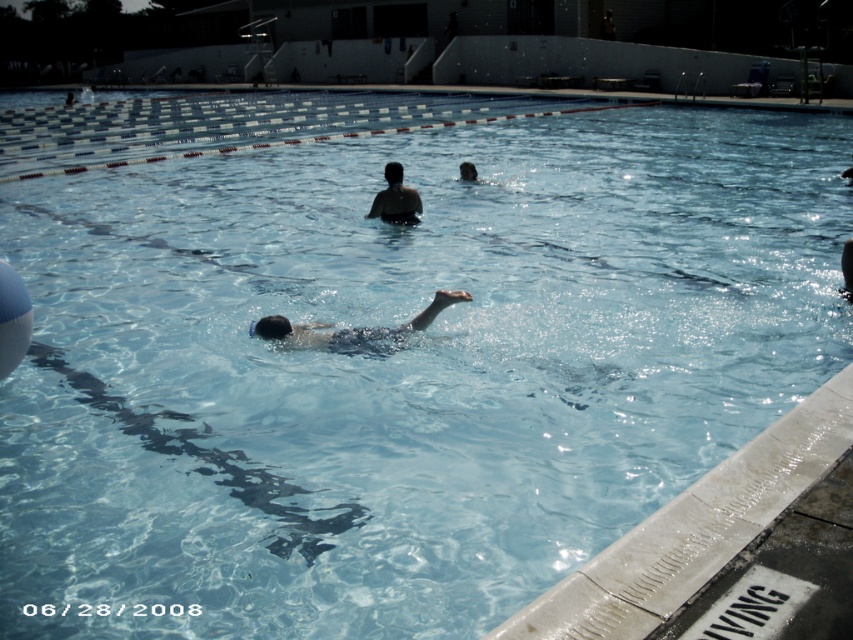
Question: Does smooth skin swimmer at center appear on the right side of dark brown hair at center?

Choices:
 (A) yes
 (B) no

Answer: (B)

Question: Does smooth skin swimmer at center appear under dark brown hair at center?

Choices:
 (A) no
 (B) yes

Answer: (B)

Question: Which of the following is the closest to the observer?

Choices:
 (A) dark brown hair at center
 (B) smooth skin swimmer at center

Answer: (B)

Question: Which object is farther from the camera taking this photo?

Choices:
 (A) smooth skin swimmer at center
 (B) dark brown hair at center

Answer: (B)

Question: Can you confirm if smooth skin swimmer at center is positioned to the left of dark brown hair at center?

Choices:
 (A) no
 (B) yes

Answer: (B)